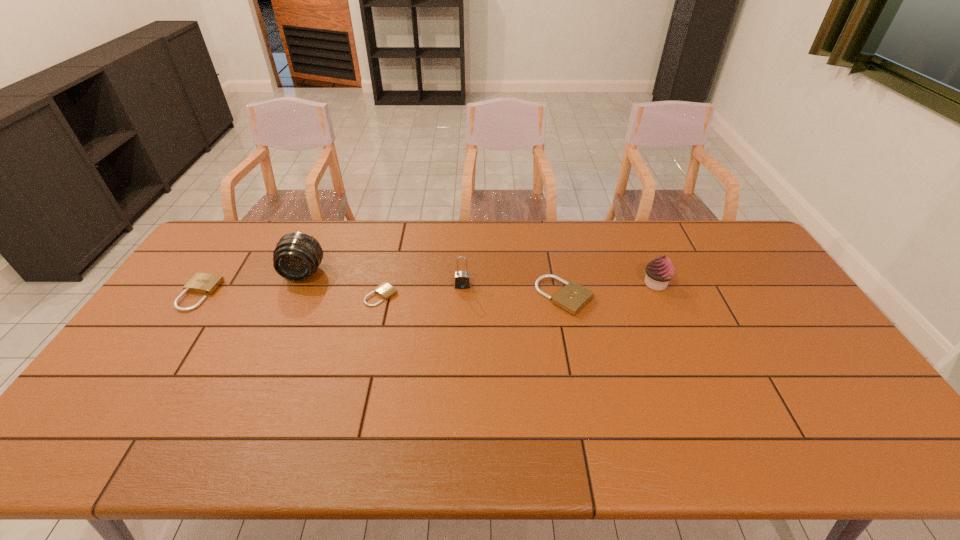
In the current image, all padlocks are evenly spaced. To maintain this equal spacing, where should an additional padlock be placed on the right? Please point out a free spot. Please provide its 2D coordinates. Your answer should be formatted as a tuple, i.e. [(x, y)], where the tuple contains the x and y coordinates of a point satisfying the conditions above.

[(748, 298)]